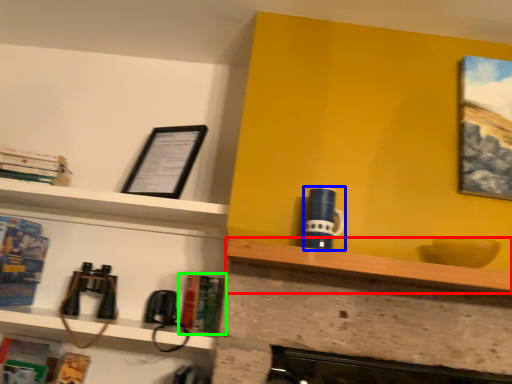
Question: Estimate the real-world distances between objects in this image. Which object is farther from shelf (highlighted by a red box), mug (highlighted by a blue box) or book (highlighted by a green box)?

Choices:
 (A) mug
 (B) book

Answer: (B)